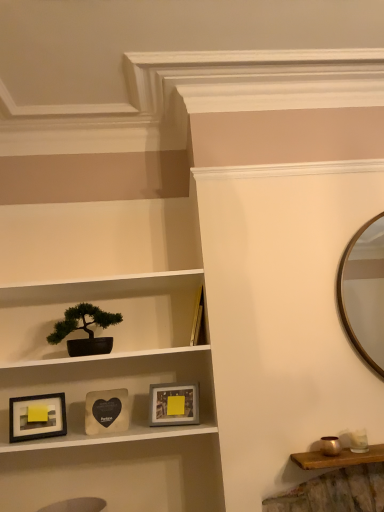
Question: Does green matte bonsai tree at left have a greater height compared to matte black picture frame at lower left, positioned as the 1th picture frame in left-to-right order?

Choices:
 (A) no
 (B) yes

Answer: (B)

Question: Considering the relative positions of green matte bonsai tree at left and matte black picture frame at lower left, positioned as the 1th picture frame in left-to-right order, in the image provided, is green matte bonsai tree at left to the left of matte black picture frame at lower left, positioned as the 1th picture frame in left-to-right order, from the viewer's perspective?

Choices:
 (A) yes
 (B) no

Answer: (B)

Question: Is green matte bonsai tree at left positioned behind matte black picture frame at lower left, positioned as the 1th picture frame in left-to-right order?

Choices:
 (A) no
 (B) yes

Answer: (B)

Question: Is green matte bonsai tree at left positioned beyond the bounds of matte black picture frame at lower left, positioned as the 1th picture frame in left-to-right order?

Choices:
 (A) no
 (B) yes

Answer: (B)

Question: Is green matte bonsai tree at left to the right of matte black picture frame at lower left, arranged as the 3th picture frame when viewed from the right, from the viewer's perspective?

Choices:
 (A) yes
 (B) no

Answer: (A)

Question: From the image's perspective, is matte gray frame at center, which ranks as the first picture frame in right-to-left order, positioned above or below green matte bonsai tree at left?

Choices:
 (A) above
 (B) below

Answer: (B)

Question: Relative to green matte bonsai tree at left, is matte gray frame at center, which ranks as the first picture frame in right-to-left order, in front or behind?

Choices:
 (A) front
 (B) behind

Answer: (B)

Question: Would you say matte gray frame at center, marked as the 3th picture frame in a left-to-right arrangement, is to the left or to the right of green matte bonsai tree at left in the picture?

Choices:
 (A) right
 (B) left

Answer: (A)

Question: Is matte gray frame at center, marked as the 3th picture frame in a left-to-right arrangement, taller or shorter than green matte bonsai tree at left?

Choices:
 (A) tall
 (B) short

Answer: (B)

Question: From a real-world perspective, is wooden heart-shaped picture frame at center, placed as the 2th picture frame when sorted from right to left, physically located above or below matte black pot at center?

Choices:
 (A) below
 (B) above

Answer: (A)

Question: Is wooden heart-shaped picture frame at center, placed as the 2th picture frame when sorted from right to left, taller or shorter than matte black pot at center?

Choices:
 (A) short
 (B) tall

Answer: (A)

Question: From the image's perspective, is wooden heart-shaped picture frame at center, the second picture frame from the left, located above or below matte black pot at center?

Choices:
 (A) below
 (B) above

Answer: (A)

Question: Considering their positions, is wooden heart-shaped picture frame at center, the second picture frame from the left, located in front of or behind matte black pot at center?

Choices:
 (A) behind
 (B) front

Answer: (A)

Question: Does point (84, 266) appear closer or farther from the camera than point (59, 401)?

Choices:
 (A) closer
 (B) farther

Answer: (B)

Question: In the image, is matte black pot at center on the left side or the right side of matte black picture frame at lower left, positioned as the 1th picture frame in left-to-right order?

Choices:
 (A) left
 (B) right

Answer: (B)